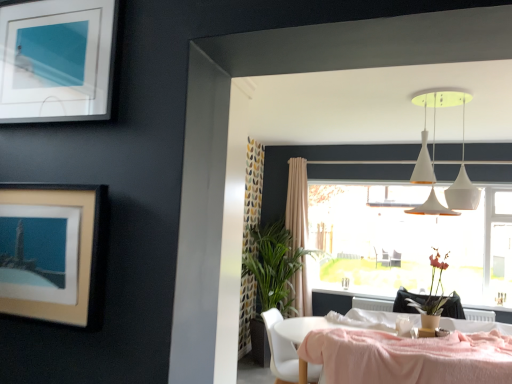
Locate an element on the screen. The width and height of the screenshot is (512, 384). beige matte picture frame at upper left, the first picture frame in the bottom-to-top sequence is located at coordinates (54, 251).

In order to click on pink fabric-covered table at lower right in this screenshot , I will do `click(392, 355)`.

Is matte brown vase at lower right next to matte silver picture frame at upper left, the second picture frame from the bottom?

No, matte brown vase at lower right is not beside matte silver picture frame at upper left, the second picture frame from the bottom.

Which object is positioned more to the left, matte brown vase at lower right or matte silver picture frame at upper left, the second picture frame from the bottom?

matte silver picture frame at upper left, the second picture frame from the bottom.

Consider the image. Could you tell me if matte brown vase at lower right is facing matte silver picture frame at upper left, which ranks as the 1th picture frame in top-to-bottom order?

No.

Between matte brown vase at lower right and matte silver picture frame at upper left, which ranks as the 1th picture frame in top-to-bottom order, which one is positioned behind?

matte brown vase at lower right is further from the camera.

Does point (505, 261) come behind point (463, 178)?

Yes, it is.

Which of these two, transparent glass window at center or white matte pendant lights at upper center, stands taller?

With more height is transparent glass window at center.

Find the location of a particular element. The height and width of the screenshot is (384, 512). lighting that is on the left side of transparent glass window at center is located at coordinates (434, 163).

Based on their sizes in the image, would you say transparent glass window at center is bigger or smaller than white matte pendant lights at upper center?

In the image, transparent glass window at center appears to be larger than white matte pendant lights at upper center.

This screenshot has width=512, height=384. In order to click on window in front of the beige fabric curtain at center in this screenshot , I will do 409,242.

Which of these two, transparent glass window at center or beige fabric curtain at center, is bigger?

With larger size is transparent glass window at center.

Considering the relative positions of transparent glass window at center and beige fabric curtain at center in the image provided, is transparent glass window at center to the left of beige fabric curtain at center from the viewer's perspective?

No.

Based on the photo, could you measure the distance between white plastic chair at lower center and beige matte picture frame at upper left, the first picture frame in the bottom-to-top sequence?

white plastic chair at lower center is 2.20 meters from beige matte picture frame at upper left, the first picture frame in the bottom-to-top sequence.

Does white plastic chair at lower center lie in front of beige matte picture frame at upper left, the first picture frame in the bottom-to-top sequence?

That is False.

From the image's perspective, is white plastic chair at lower center on beige matte picture frame at upper left, placed as the second picture frame when sorted from top to bottom?

No, from the image's perspective, white plastic chair at lower center is not above beige matte picture frame at upper left, placed as the second picture frame when sorted from top to bottom.

In the scene shown: Can you confirm if white plastic chair at lower center is shorter than beige matte picture frame at upper left, placed as the second picture frame when sorted from top to bottom?

No, white plastic chair at lower center is not shorter than beige matte picture frame at upper left, placed as the second picture frame when sorted from top to bottom.

The image size is (512, 384). I want to click on curtain behind the beige matte picture frame at upper left, placed as the second picture frame when sorted from top to bottom, so (x=297, y=202).

Does point (296, 271) appear closer or farther from the camera than point (67, 194)?

Point (296, 271) appears to be farther away from the viewer than point (67, 194).

From the image's perspective, between beige fabric curtain at center and beige matte picture frame at upper left, the first picture frame in the bottom-to-top sequence, who is located below?

Result: beige fabric curtain at center, from the image's perspective.

Considering the relative sizes of beige fabric curtain at center and beige matte picture frame at upper left, the first picture frame in the bottom-to-top sequence, in the image provided, is beige fabric curtain at center smaller than beige matte picture frame at upper left, the first picture frame in the bottom-to-top sequence,?

Incorrect, beige fabric curtain at center is not smaller in size than beige matte picture frame at upper left, the first picture frame in the bottom-to-top sequence.

Which of these two, beige fabric curtain at center or white plastic chair at lower center, is thinner?

Thinner between the two is beige fabric curtain at center.

Is beige fabric curtain at center bigger or smaller than white plastic chair at lower center?

beige fabric curtain at center is bigger than white plastic chair at lower center.

Is beige fabric curtain at center spatially inside white plastic chair at lower center, or outside of it?

beige fabric curtain at center is not enclosed by white plastic chair at lower center.

Relative to matte brown vase at lower right, is beige matte picture frame at upper left, placed as the second picture frame when sorted from top to bottom, in front or behind?

beige matte picture frame at upper left, placed as the second picture frame when sorted from top to bottom, is in front of matte brown vase at lower right.

From the image's perspective, is beige matte picture frame at upper left, placed as the second picture frame when sorted from top to bottom, positioned above or below matte brown vase at lower right?

beige matte picture frame at upper left, placed as the second picture frame when sorted from top to bottom, is above matte brown vase at lower right.

From a real-world perspective, relative to matte brown vase at lower right, is beige matte picture frame at upper left, placed as the second picture frame when sorted from top to bottom, vertically above or below?

In terms of real-world spatial position, beige matte picture frame at upper left, placed as the second picture frame when sorted from top to bottom, is above matte brown vase at lower right.

Looking at this image, choose the correct answer: Is beige matte picture frame at upper left, the first picture frame in the bottom-to-top sequence, inside matte brown vase at lower right or outside it?

beige matte picture frame at upper left, the first picture frame in the bottom-to-top sequence, lies outside matte brown vase at lower right.

Identify the location of flower on the right of matte silver picture frame at upper left, the second picture frame from the bottom. This screenshot has height=384, width=512. (433, 289).

You are a GUI agent. You are given a task and a screenshot of the screen. Output one action in this format:
    pyautogui.click(x=<x>, y=<y>)
    Task: Click on the window that is under the white matte pendant lights at upper center (from a real-world perspective)
    The width and height of the screenshot is (512, 384).
    Given the screenshot: What is the action you would take?
    pyautogui.click(x=409, y=242)

Estimate the real-world distances between objects in this image. Which object is closer to transparent glass window at center, beige fabric curtain at center or matte silver picture frame at upper left, which ranks as the 1th picture frame in top-to-bottom order?

Based on the image, beige fabric curtain at center appears to be nearer to transparent glass window at center.

When comparing their distances from transparent glass window at center, does matte silver picture frame at upper left, the second picture frame from the bottom, or beige fabric curtain at center seem closer?

Among the two, beige fabric curtain at center is located nearer to transparent glass window at center.

Which object lies nearer to the anchor point beige matte picture frame at upper left, the first picture frame in the bottom-to-top sequence, beige fabric curtain at center or white matte pendant lights at upper center?

white matte pendant lights at upper center.

Based on their spatial positions, is beige fabric curtain at center or beige matte picture frame at upper left, placed as the second picture frame when sorted from top to bottom, closer to matte silver picture frame at upper left, the second picture frame from the bottom?

beige matte picture frame at upper left, placed as the second picture frame when sorted from top to bottom, is closer to matte silver picture frame at upper left, the second picture frame from the bottom.

Based on their spatial positions, is white plastic chair at lower center or matte brown vase at lower right closer to white matte pendant lights at upper center?

matte brown vase at lower right.

Considering their positions, is matte silver picture frame at upper left, the second picture frame from the bottom, positioned further to matte brown vase at lower right than beige matte picture frame at upper left, placed as the second picture frame when sorted from top to bottom?

The object further to matte brown vase at lower right is matte silver picture frame at upper left, the second picture frame from the bottom.

Estimate the real-world distances between objects in this image. Which object is further from white matte pendant lights at upper center, transparent glass window at center or beige matte picture frame at upper left, placed as the second picture frame when sorted from top to bottom?

beige matte picture frame at upper left, placed as the second picture frame when sorted from top to bottom, is further to white matte pendant lights at upper center.

Based on their spatial positions, is transparent glass window at center or white plastic chair at lower center further from beige fabric curtain at center?

Based on the image, white plastic chair at lower center appears to be further to beige fabric curtain at center.

The height and width of the screenshot is (384, 512). In order to click on lighting between pink fabric-covered table at lower right and transparent glass window at center from front to back in this screenshot , I will do `click(434, 163)`.

At what (x,y) coordinates should I click in order to perform the action: click on window positioned between pink fabric-covered table at lower right and beige fabric curtain at center from near to far. Please return your answer as a coordinate pair (x, y). This screenshot has width=512, height=384. Looking at the image, I should click on (409, 242).

Locate an element on the screen. flower between white matte pendant lights at upper center and white plastic chair at lower center in the vertical direction is located at coordinates (433, 289).

Locate an element on the screen. picture frame between beige matte picture frame at upper left, the first picture frame in the bottom-to-top sequence, and white matte pendant lights at upper center is located at coordinates (56, 60).